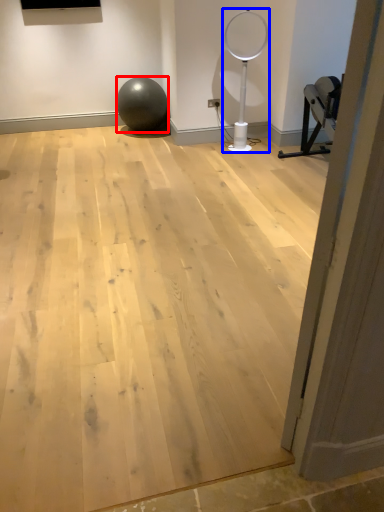
Question: Which object appears farthest to the camera in this image, ball (highlighted by a red box) or basketball hoop (highlighted by a blue box)?

Choices:
 (A) ball
 (B) basketball hoop

Answer: (A)